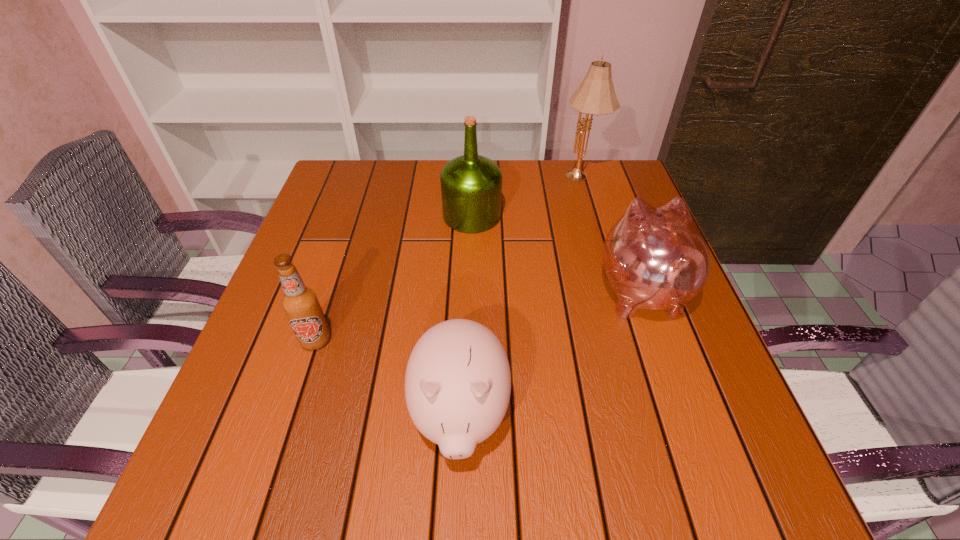
Where is `vacant region between the shorter piggy bank and the lampshade`? vacant region between the shorter piggy bank and the lampshade is located at coordinates 520,296.

This screenshot has width=960, height=540. Identify the location of free spot between the shortest object and the tallest object. (520, 296).

This screenshot has width=960, height=540. What are the coordinates of `vacant point located between the beer bottle and the tallest object` in the screenshot? It's located at (448, 259).

I want to click on vacant space in between the farther piggy bank and the beer bottle, so click(478, 315).

In order to click on unoccupied area between the olive oil and the right piggy bank in this screenshot , I will do `click(557, 253)`.

Where is `the closest object to the shortest object`? Image resolution: width=960 pixels, height=540 pixels. the closest object to the shortest object is located at coordinates (300, 303).

Locate which object ranks fourth in proximity to the right piggy bank. Please provide its 2D coordinates. Your answer should be formatted as a tuple, i.e. [(x, y)], where the tuple contains the x and y coordinates of a point satisfying the conditions above.

[(300, 303)]